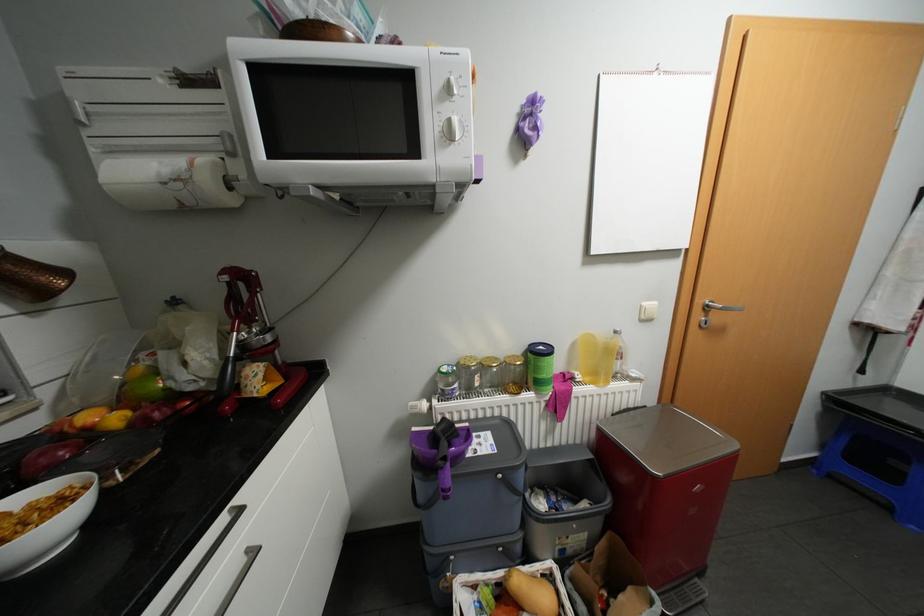
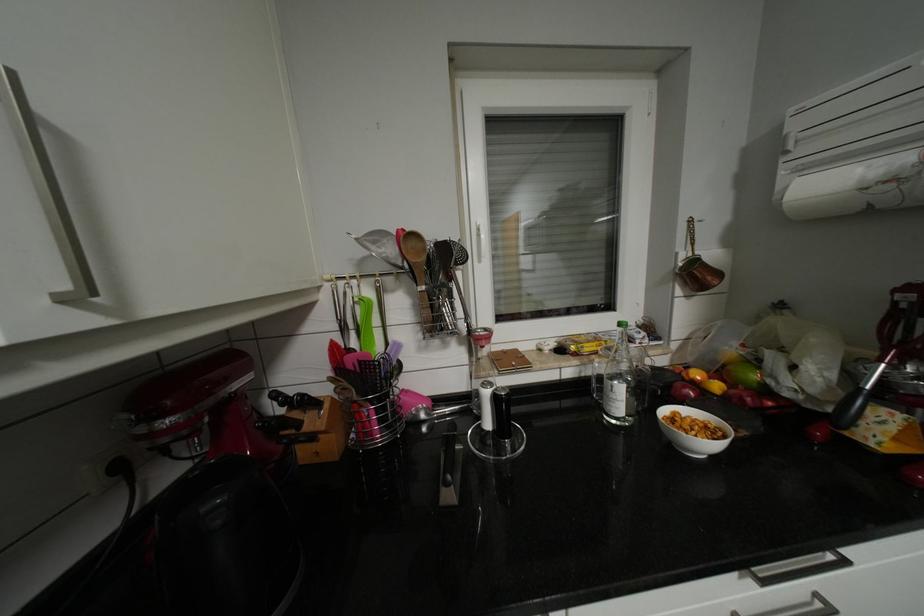
Where in the second image is the point corresponding to pixel 94 418 from the first image?

(704, 374)